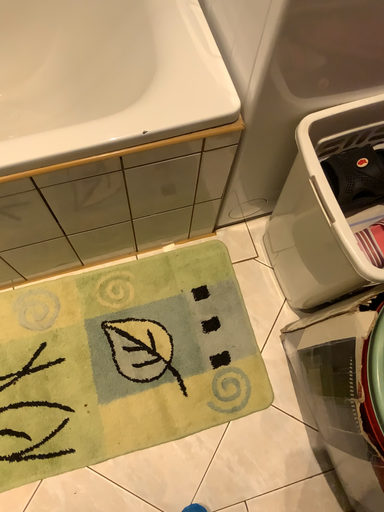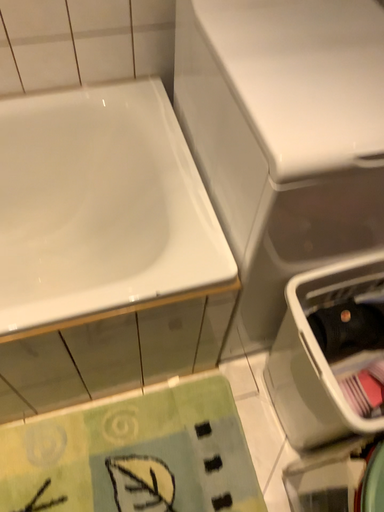
Question: How did the camera likely rotate when shooting the video?

Choices:
 (A) rotated upward
 (B) rotated downward

Answer: (A)